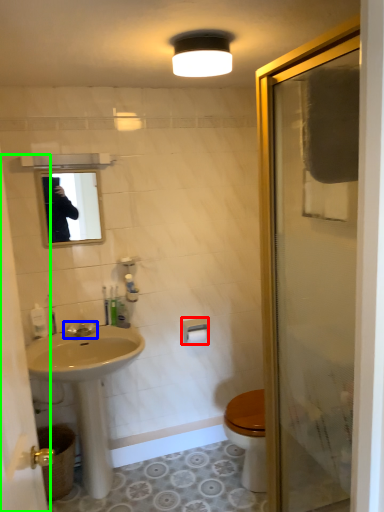
Question: Based on their relative distances, which object is nearer to towel bar (highlighted by a red box)? Choose from tap (highlighted by a blue box) and screen door (highlighted by a green box).

Choices:
 (A) tap
 (B) screen door

Answer: (A)